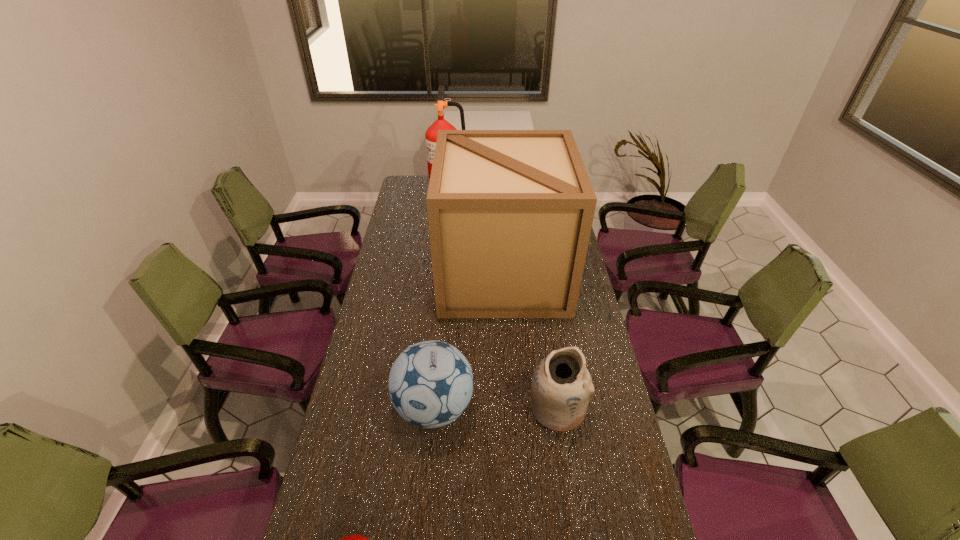
Locate an element on the screen. the fourth nearest object is located at coordinates (510, 212).

Locate an element on the screen. fire extinguisher is located at coordinates (431, 134).

Find the location of a particular element. This screenshot has height=540, width=960. soccer ball is located at coordinates (431, 383).

Locate an element on the screen. The height and width of the screenshot is (540, 960). pottery is located at coordinates (561, 386).

This screenshot has height=540, width=960. What are the coordinates of `free space located on the reinforced sides of the fourth nearest object` in the screenshot? It's located at (409, 274).

You are a GUI agent. You are given a task and a screenshot of the screen. Output one action in this format:
    pyautogui.click(x=<x>, y=<y>)
    Task: Click on the free location located 0.070m on the reinforced sides of the fourth nearest object
    
    Given the screenshot: What is the action you would take?
    pyautogui.click(x=424, y=274)

Where is `free space located 0.190m on the reinforced sides of the fourth nearest object`? This screenshot has height=540, width=960. free space located 0.190m on the reinforced sides of the fourth nearest object is located at coordinates (394, 274).

At what (x,y) coordinates should I click in order to perform the action: click on free region located 0.230m at the nozzle of the fire extinguisher. Please return your answer as a coordinate pair (x, y). Image resolution: width=960 pixels, height=540 pixels. Looking at the image, I should click on (519, 191).

This screenshot has width=960, height=540. Find the location of `vacant position located 0.090m on the side with brand of the soccer ball`. vacant position located 0.090m on the side with brand of the soccer ball is located at coordinates (428, 478).

This screenshot has width=960, height=540. I want to click on blank space located on the left of the pottery, so click(461, 407).